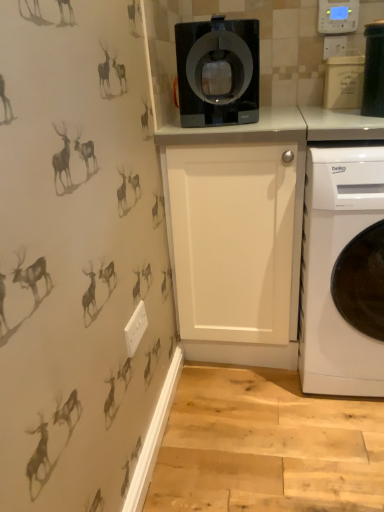
Find the location of a particular element. free space in front of black glossy coffee machine at upper center is located at coordinates (228, 129).